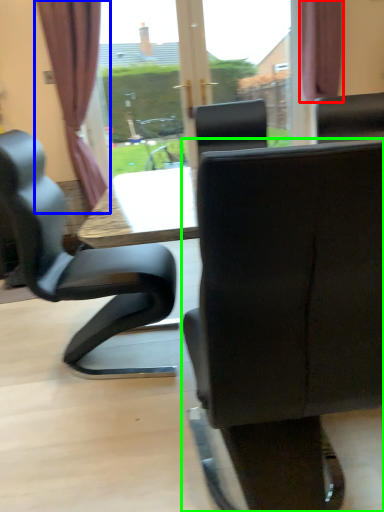
Question: Which is nearer to the curtain (highlighted by a red box)? curtain (highlighted by a blue box) or chair (highlighted by a green box).

Choices:
 (A) curtain
 (B) chair

Answer: (A)